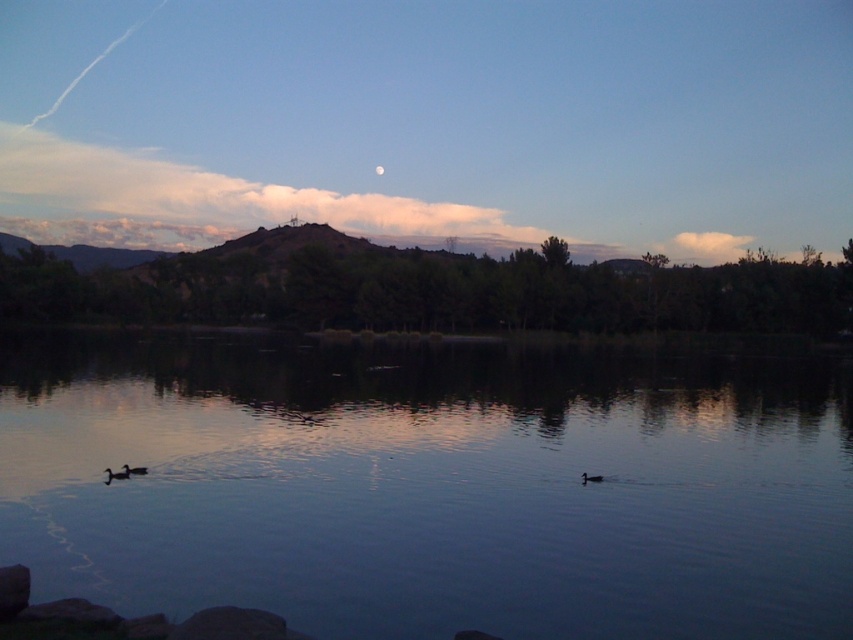
Question: Can you confirm if clear water at center is positioned below dark gray feathers duck at lower left?

Choices:
 (A) yes
 (B) no

Answer: (A)

Question: Considering the real-world distances, which object is closest to the clear water at center?

Choices:
 (A) matte black duck at center
 (B) dark gray feathers duck at lower left

Answer: (B)

Question: Which object is farther from the camera taking this photo?

Choices:
 (A) dark brown duck at lower left
 (B) matte black duck at center

Answer: (B)

Question: Which point appears farthest from the camera in this image?

Choices:
 (A) (585, 481)
 (B) (123, 465)
 (C) (103, 468)

Answer: (A)

Question: Is clear water at center to the right of dark gray feathers duck at lower left from the viewer's perspective?

Choices:
 (A) no
 (B) yes

Answer: (A)

Question: Can you confirm if clear water at center is positioned below dark gray feathers duck at lower left?

Choices:
 (A) no
 (B) yes

Answer: (B)